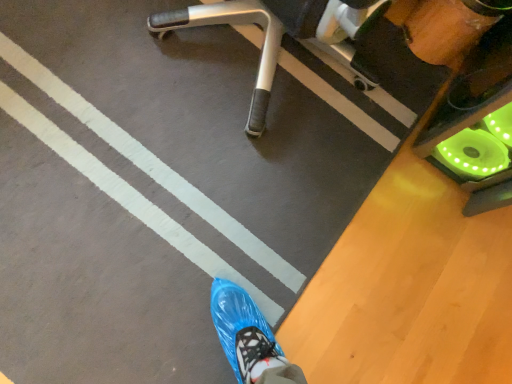
Question: From the image's perspective, is metallic silver chair at upper center positioned above or below matte plastic shoe cover at lower center?

Choices:
 (A) above
 (B) below

Answer: (A)

Question: Considering the positions of point (369, 56) and point (10, 44), is point (369, 56) closer or farther from the camera than point (10, 44)?

Choices:
 (A) farther
 (B) closer

Answer: (A)

Question: Considering the positions of metallic silver chair at upper center and matte plastic shoe cover at lower center in the image, is metallic silver chair at upper center wider or thinner than matte plastic shoe cover at lower center?

Choices:
 (A) thin
 (B) wide

Answer: (A)

Question: Is point (25, 69) positioned closer to the camera than point (487, 193)?

Choices:
 (A) farther
 (B) closer

Answer: (B)

Question: Is matte plastic shoe cover at lower center situated inside metallic silver chair at upper center or outside?

Choices:
 (A) inside
 (B) outside

Answer: (B)

Question: From a real-world perspective, is matte plastic shoe cover at lower center above or below metallic silver chair at upper center?

Choices:
 (A) below
 (B) above

Answer: (A)

Question: Is matte plastic shoe cover at lower center wider or thinner than metallic silver chair at upper center?

Choices:
 (A) wide
 (B) thin

Answer: (A)